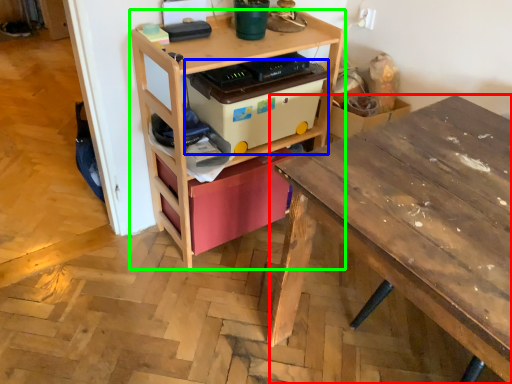
Question: Which object is positioned closest to desk (highlighted by a red box)? Select from storage box (highlighted by a blue box) and shelf (highlighted by a green box).

Choices:
 (A) storage box
 (B) shelf

Answer: (A)